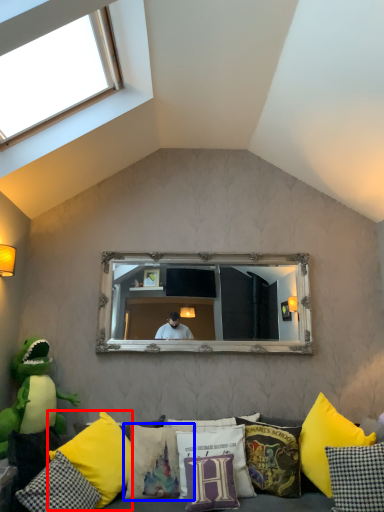
Question: Among these objects, which one is nearest to the camera, pillow (highlighted by a red box) or pillow (highlighted by a blue box)?

Choices:
 (A) pillow
 (B) pillow

Answer: (A)